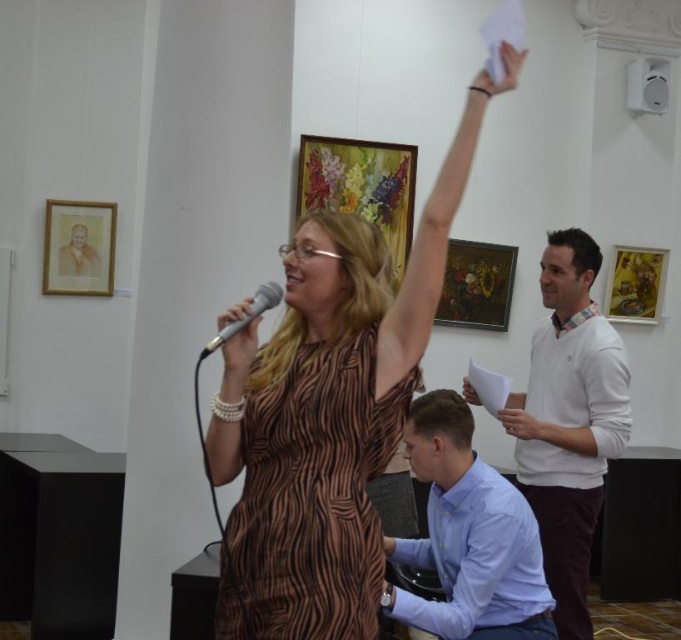
Please look at the point marked at coordinates (x=569, y=420). What object is located there?

The point at coordinates (x=569, y=420) marks the white cotton shirt at upper right.

You are an event planner organizing an art auction. You need to ensure that the brown textured dress at center does not block the view of the wooden oil painting at center. Given their widths, which object should be positioned further back to maintain visibility?

The brown textured dress at center is wider than the wooden oil painting at center. To ensure the wooden oil painting at center remains visible, the brown textured dress at center should be positioned further back so that its greater width doesn not obstruct the view of the narrower wooden oil painting at center.